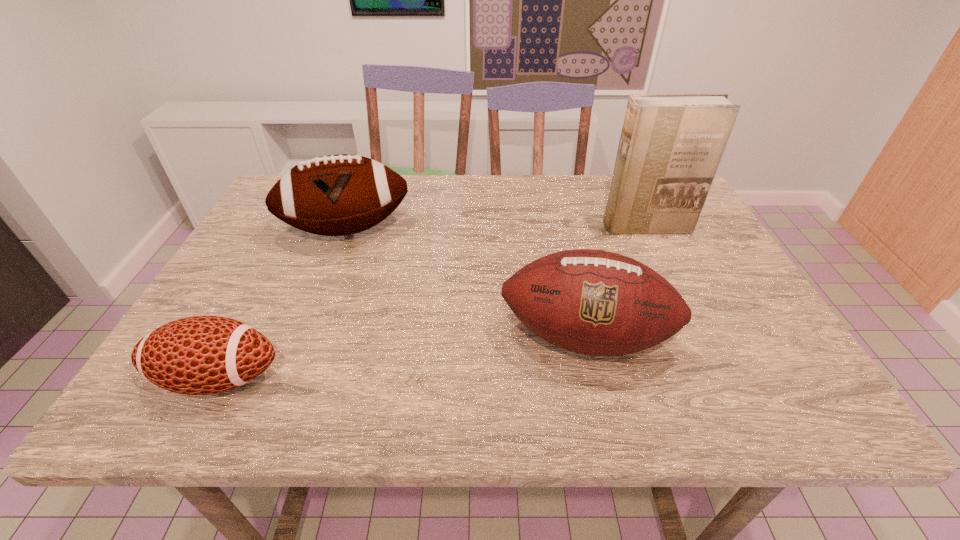
Find the location of a particular element. The height and width of the screenshot is (540, 960). free space between the phonebook and the shortest football is located at coordinates (432, 302).

Where is `free space that is in between the shortest football and the farthest football`? This screenshot has width=960, height=540. free space that is in between the shortest football and the farthest football is located at coordinates (283, 304).

Find the location of a particular element. vacant region between the shortest object and the tallest object is located at coordinates (432, 302).

Where is `free spot between the phonebook and the farthest football`? free spot between the phonebook and the farthest football is located at coordinates click(496, 228).

The height and width of the screenshot is (540, 960). I want to click on free space that is in between the farthest football and the rightmost football, so click(x=466, y=284).

Where is `vacant area that lies between the farthest football and the shortest object`? vacant area that lies between the farthest football and the shortest object is located at coordinates (283, 304).

Image resolution: width=960 pixels, height=540 pixels. I want to click on vacant space that is in between the rightmost football and the farthest football, so click(466, 284).

Select which object is the third closest to the shortest football. Please provide its 2D coordinates. Your answer should be formatted as a tuple, i.e. [(x, y)], where the tuple contains the x and y coordinates of a point satisfying the conditions above.

[(670, 147)]

Where is `the second closest object relative to the phonebook`? The image size is (960, 540). the second closest object relative to the phonebook is located at coordinates (336, 195).

Find the location of a particular element. This screenshot has height=540, width=960. football that can be found as the closest to the farthest football is located at coordinates [593, 302].